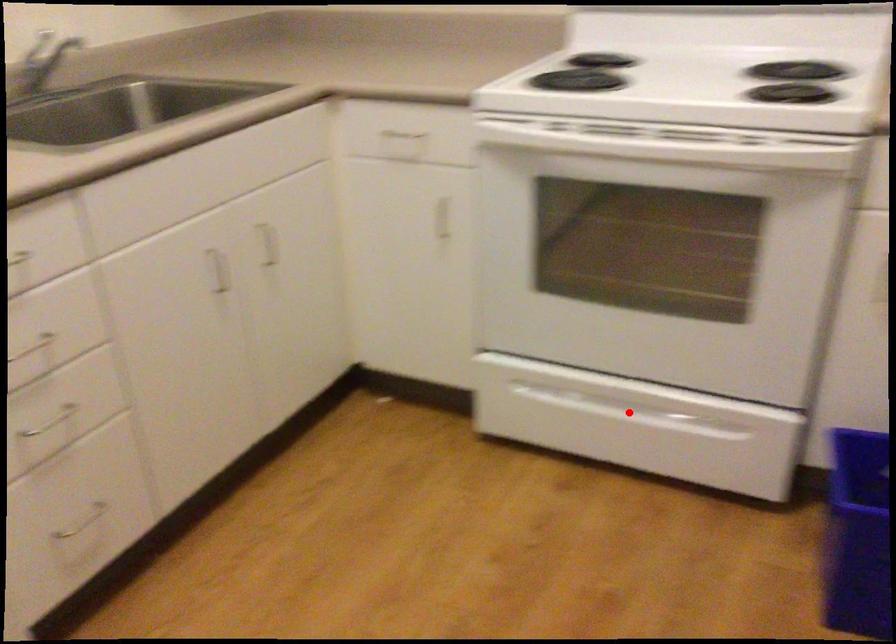
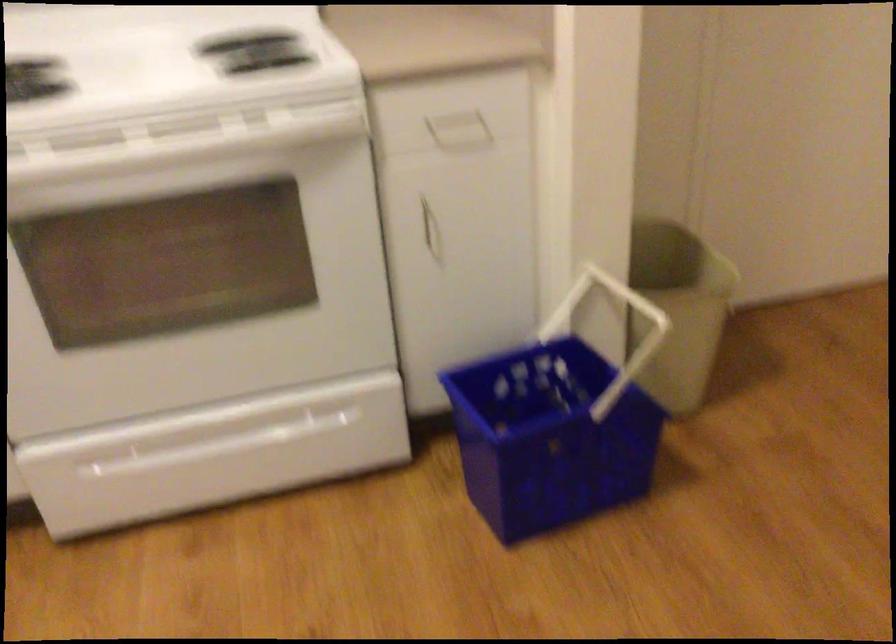
Question: I am providing you with two images of the same scene from different viewpoints. Image1 has a red point marked. In image2, the corresponding 3D location appears at what relative position? Reply with the corresponding letter.

Choices:
 (A) Closer
 (B) Farther

Answer: (A)